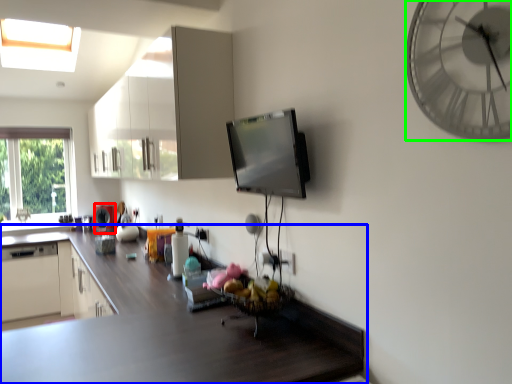
Question: Based on their relative distances, which object is farther from appliance (highlighted by a red box)? Choose from countertop (highlighted by a blue box) and wall clock (highlighted by a green box).

Choices:
 (A) countertop
 (B) wall clock

Answer: (B)